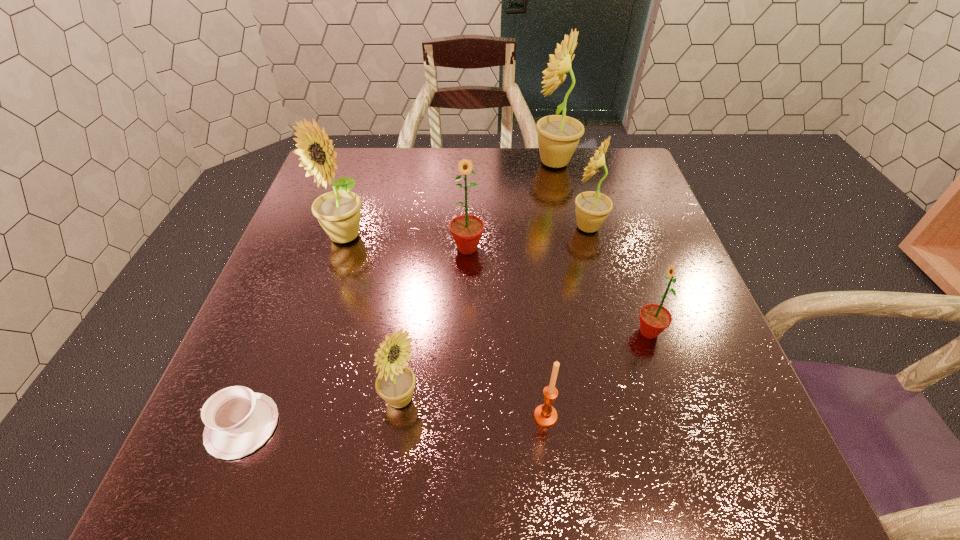
I want to click on the tallest object, so click(558, 135).

Locate an element on the screen. This screenshot has width=960, height=540. the farthest object is located at coordinates (558, 135).

What are the coordinates of `the third smallest yellow sunflower` in the screenshot? It's located at (338, 212).

Image resolution: width=960 pixels, height=540 pixels. Find the location of `the fifth shortest sunflower`. the fifth shortest sunflower is located at coordinates (338, 212).

The height and width of the screenshot is (540, 960). I want to click on the third biggest yellow sunflower, so click(592, 208).

Locate an element on the screen. The image size is (960, 540). the fourth sunflower from right to left is located at coordinates (466, 230).

Where is `the farther green sunflower`? The width and height of the screenshot is (960, 540). the farther green sunflower is located at coordinates (466, 230).

The image size is (960, 540). I want to click on the smallest yellow sunflower, so click(x=395, y=383).

Identify the location of the nearest sunflower. (395, 383).

Where is `the smaller green sunflower`? the smaller green sunflower is located at coordinates (654, 319).